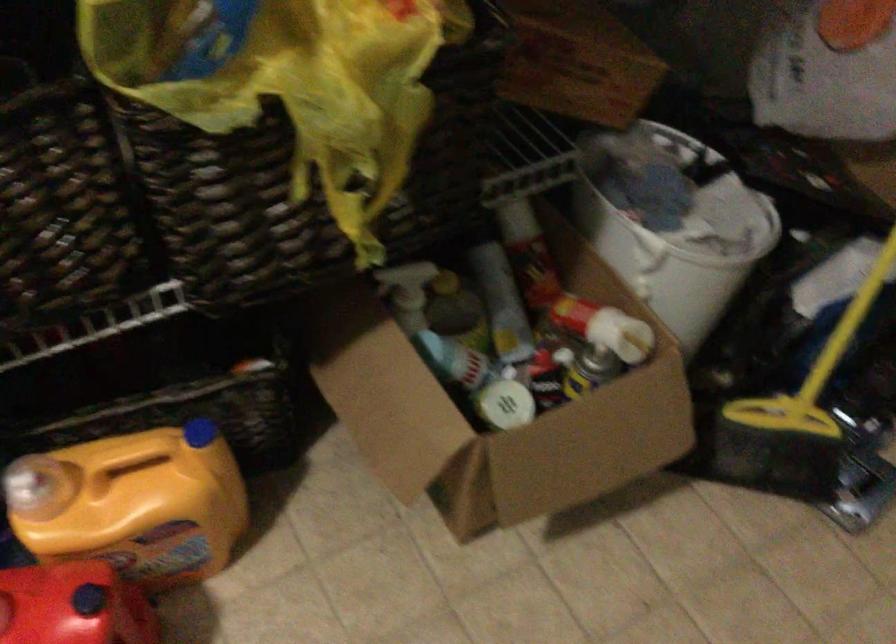
This screenshot has width=896, height=644. Find the location of `yellow broom handle`. yellow broom handle is located at coordinates (849, 323).